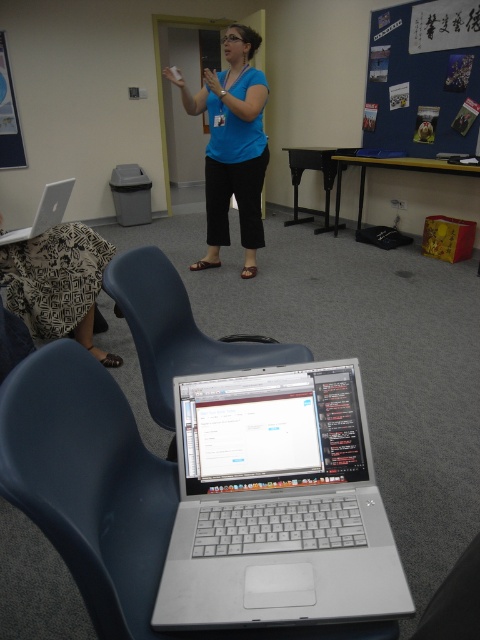
Question: Is blue plastic chair at center smaller than matte blue shirt at center?

Choices:
 (A) no
 (B) yes

Answer: (B)

Question: Which point is closer to the camera taking this photo?

Choices:
 (A) (447, 51)
 (B) (352, 461)

Answer: (B)

Question: Which point is farther from the camera taking this photo?

Choices:
 (A) (373, 26)
 (B) (120, 304)
 (C) (216, 77)

Answer: (A)

Question: Which point is closer to the camera?

Choices:
 (A) (257, 80)
 (B) (257, 360)
 (C) (440, 102)
 (D) (48, 188)

Answer: (B)

Question: Is matte blue shirt at center above matte silver laptop at left?

Choices:
 (A) yes
 (B) no

Answer: (A)

Question: In this image, where is blue plastic chair at center located relative to matte silver laptop at left?

Choices:
 (A) right
 (B) left

Answer: (A)